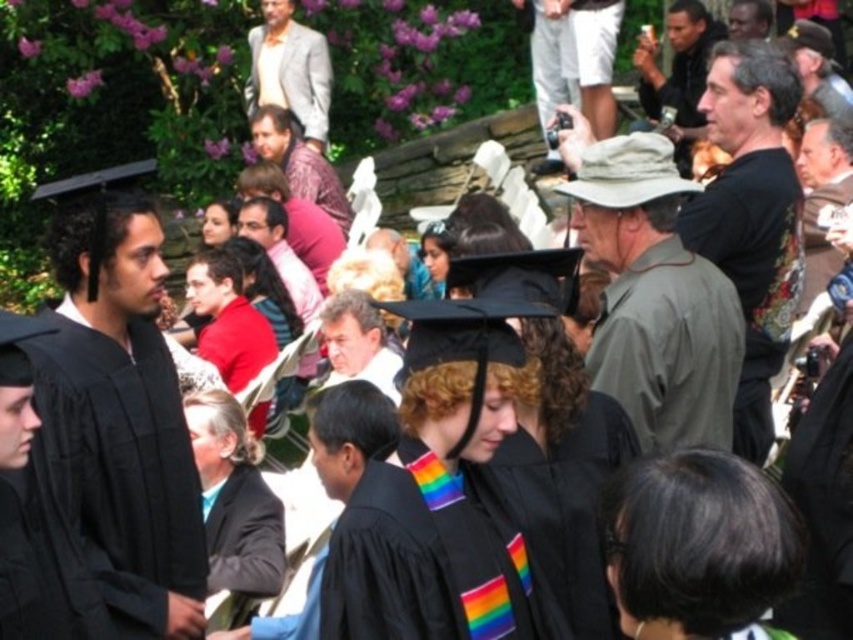
Does light brown hair at center have a greater height compared to matte black graduation cap at center?

Yes.

How far apart are light brown hair at center and matte black graduation cap at center?

light brown hair at center and matte black graduation cap at center are 5.00 meters apart.

Locate an element on the screen. light brown hair at center is located at coordinates (357, 340).

Is green matte hat at center taller than patterned silk shirt at center?

Yes, green matte hat at center is taller than patterned silk shirt at center.

Which is above, green matte hat at center or patterned silk shirt at center?

patterned silk shirt at center is above.

In the scene shown: Who is more distant from viewer, (605, 305) or (257, 120)?

Point (257, 120)

I want to click on green matte hat at center, so click(x=654, y=298).

In the scene shown: How distant is matte black graduation gown at left from matte black hat at upper right?

matte black graduation gown at left and matte black hat at upper right are 19.90 meters apart from each other.

Is matte black graduation gown at left below matte black hat at upper right?

Yes.

Which is behind, point (102, 595) or point (660, 102)?

The point (660, 102) is more distant.

At what (x,y) coordinates should I click in order to perform the action: click on matte black graduation gown at left. Please return your answer as a coordinate pair (x, y). The image size is (853, 640). Looking at the image, I should click on (117, 424).